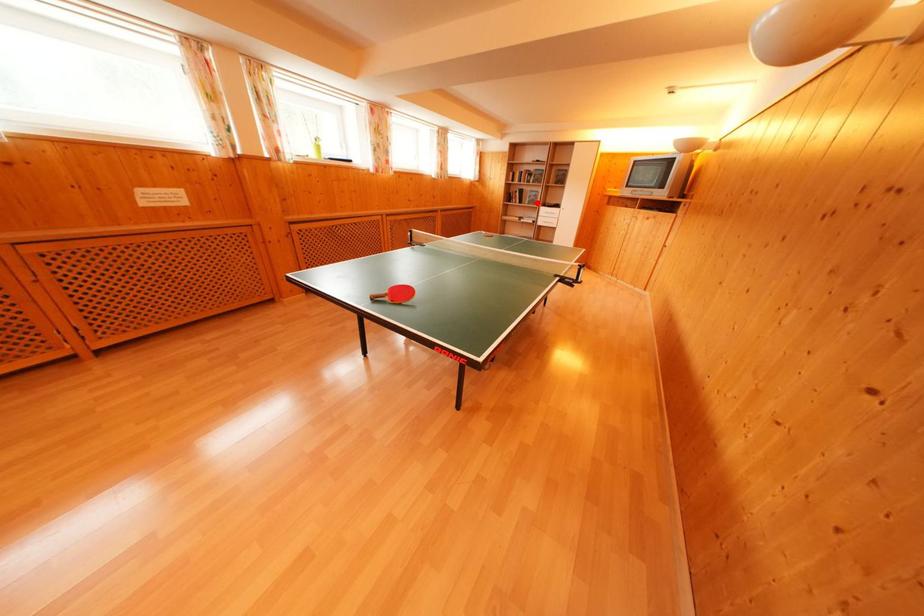
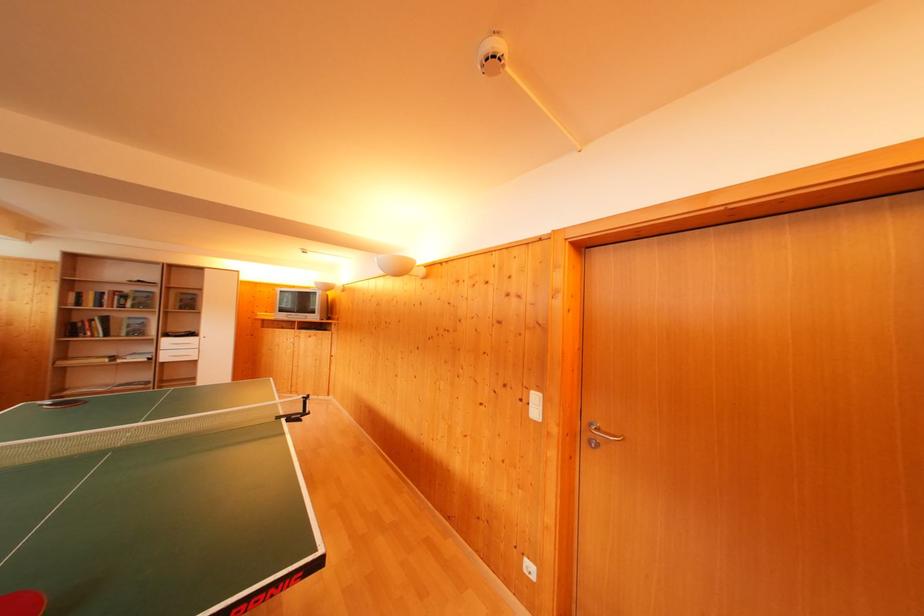
Question: I am providing you with two images of the same scene from different viewpoints. A red point is shown in image1. For the corresponding object point in image2, is it positioned nearer or farther from the camera?

Choices:
 (A) Nearer
 (B) Farther

Answer: (B)